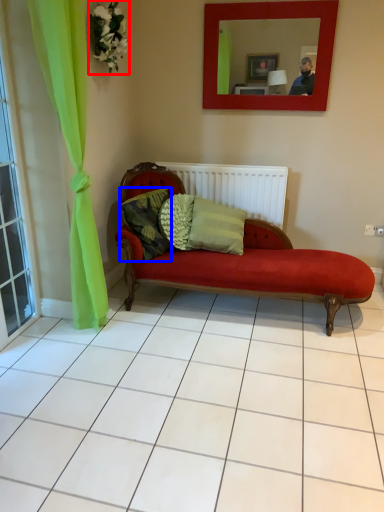
Question: Among these objects, which one is farthest to the camera, flower (highlighted by a red box) or pillow (highlighted by a blue box)?

Choices:
 (A) flower
 (B) pillow

Answer: (B)